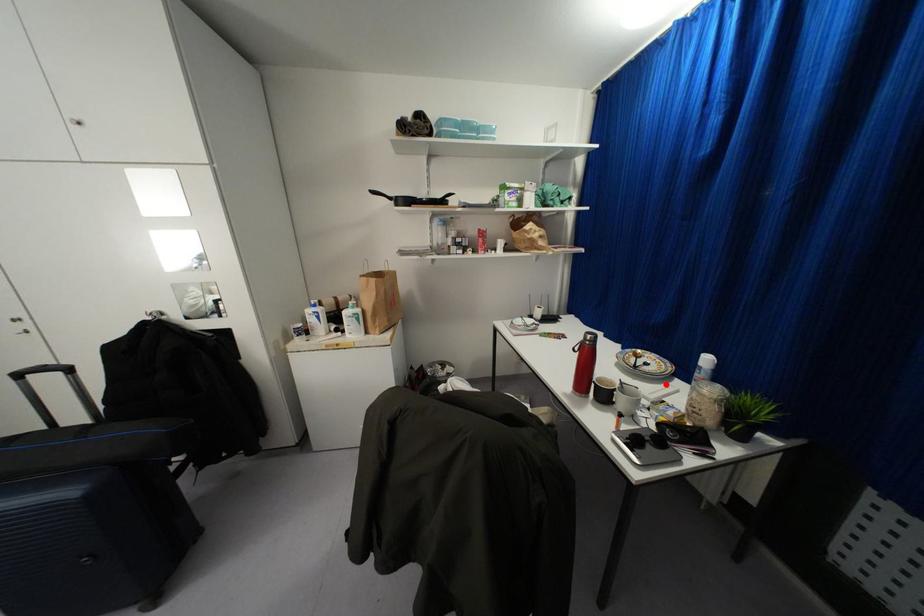
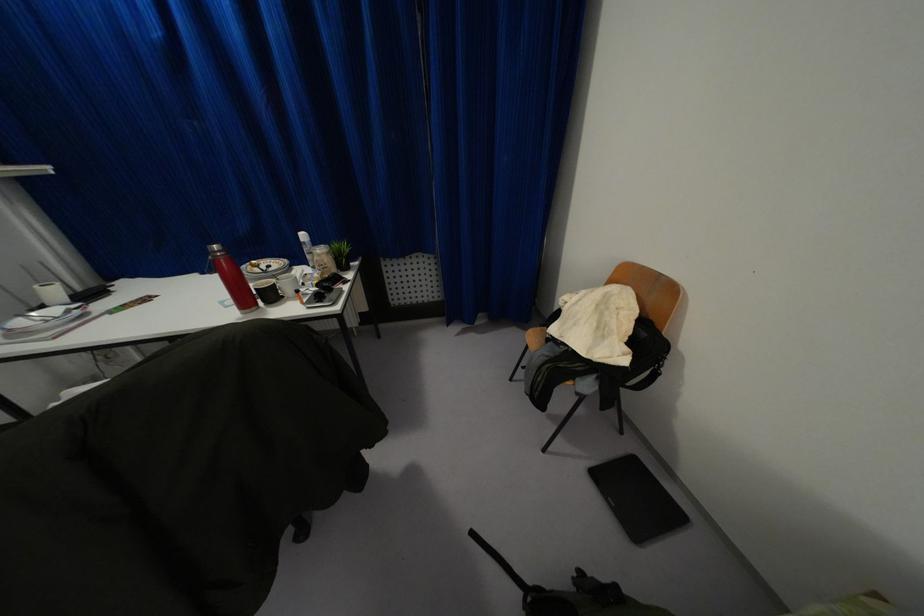
Where in the second image is the point corresponding to the highlighted location from the first image?

(294, 270)